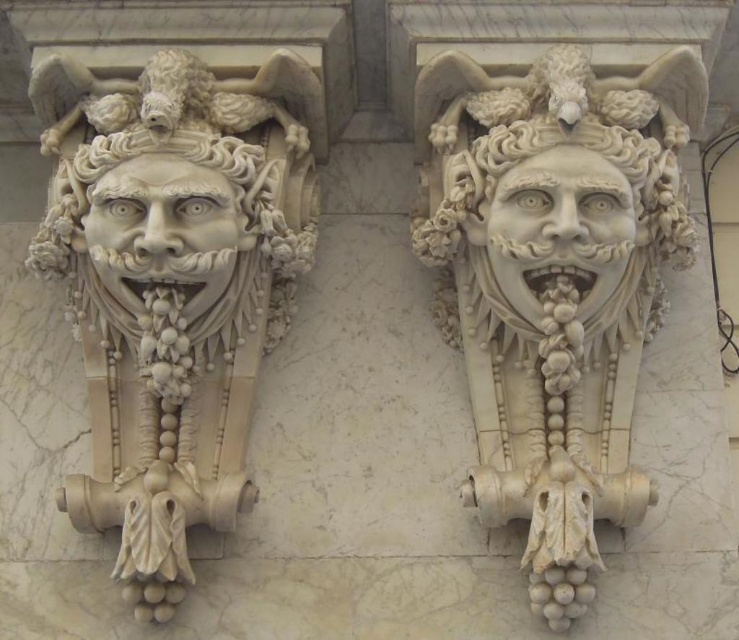
You are an art restorer examining the marble wall. You need to determine which object takes up more space on the wall. Which one is larger in size between the white marble mask at center and the white marble face at left?

The white marble face at left is larger in size because the white marble mask at center occupies less space than it.

You are an architect designing a new museum exhibit. You need to place a spotlight exactly at the center of the white marble mask at left. Given that the mask is represented by the point coordinates point [173,284], what are the coordinates of the center of the white marble mask at left?

The coordinates of the center of the white marble mask at left are point [173,284].

In the image of two sculpted faces on a marble wall, where is the white marble mask at center located relative to the white marble face at left?

The white marble mask at center is to the right of the white marble face at left.